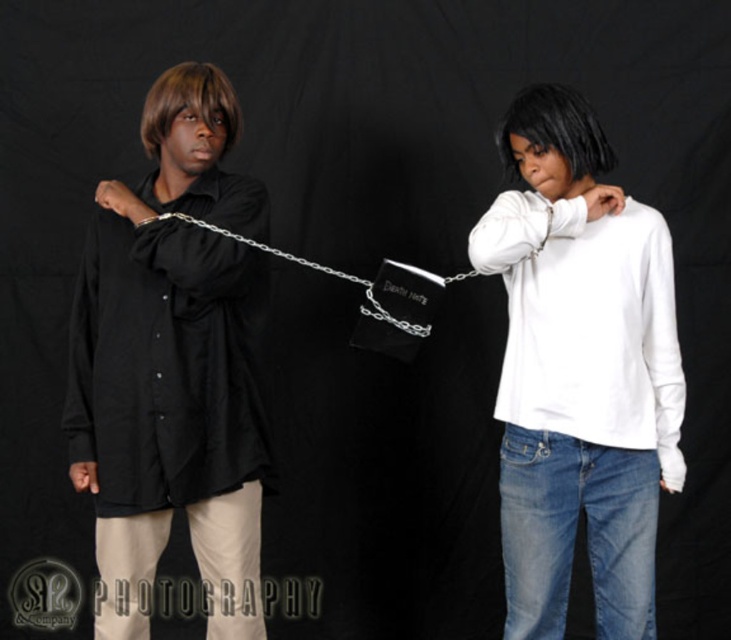
You are a fashion designer analyzing the image. You need to determine which of the two shirts, the black matte shirt at left or the white matte shirt at center, is narrower in width. Which one is narrower?

The black matte shirt at left has a lesser width compared to the white matte shirt at center, so the black matte shirt at left is narrower.

Based on the scene description, where is the white matte shirt at center positioned in relation to the other elements?

The white matte shirt at center is located at point coordinates 0.584 on the x and 0.795 on the y axis.

You are observing two points marked in an image of two people connected by a chain. The points are labeled as point 1 at coordinates point (197, 474) and point 2 at coordinates point (599, 490). Based on their positions, which point is closer to the observer?

Point (197, 474) is in front of point (599, 490), so it is closer to the observer.